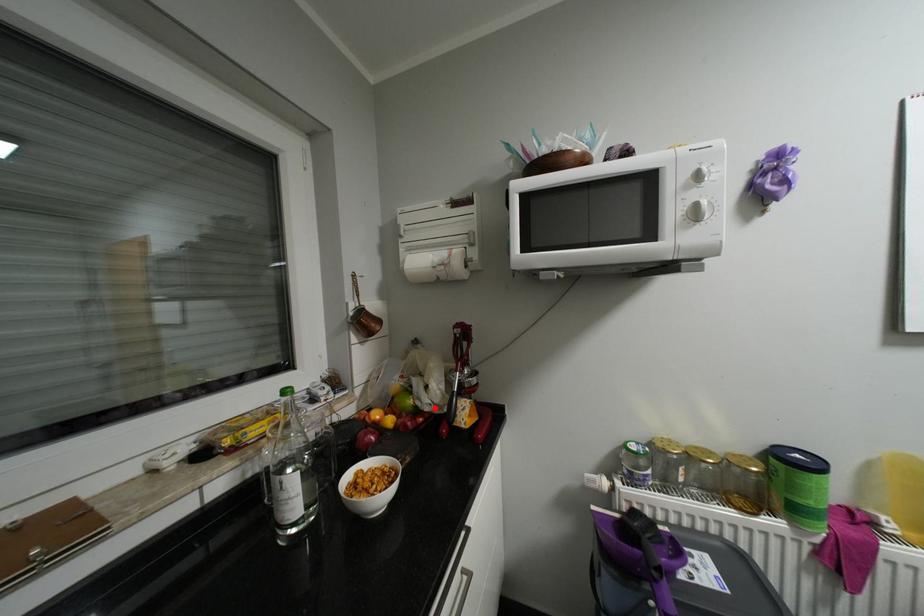
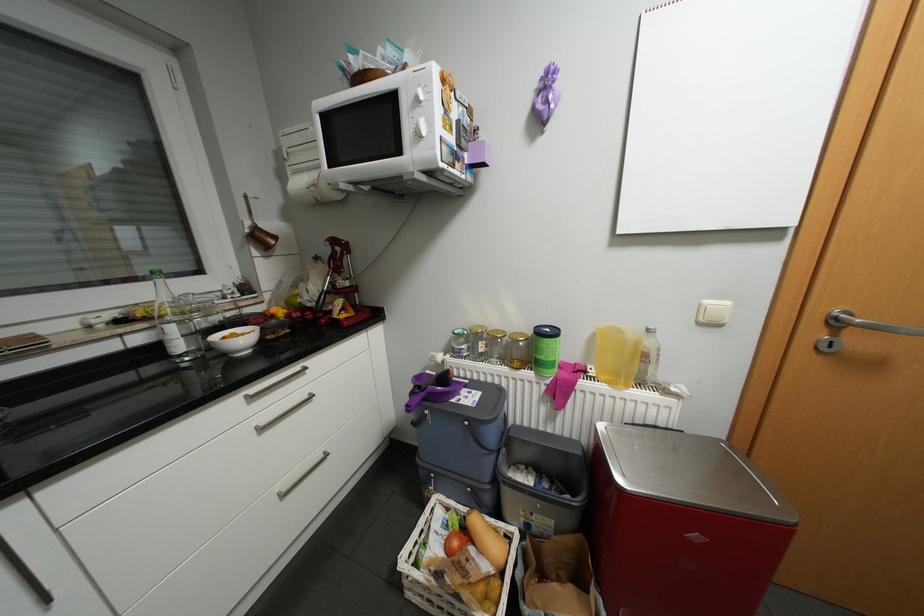
Question: I am providing you with two images of the same scene from different viewpoints. A red point is marked on the first image. Can you still see the location of the red point in image 2?

Choices:
 (A) Yes
 (B) No

Answer: (A)